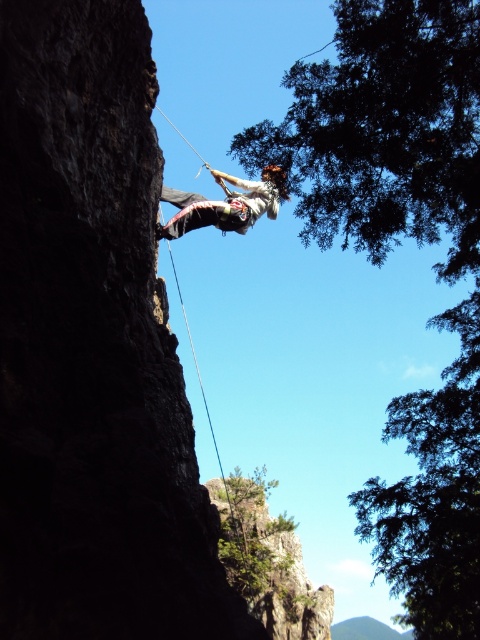
Does green leafy tree at upper right have a smaller size compared to white climbing harness at center?

Actually, green leafy tree at upper right might be larger than white climbing harness at center.

Can you confirm if green leafy tree at upper right is bigger than white climbing harness at center?

Indeed, green leafy tree at upper right has a larger size compared to white climbing harness at center.

Which is in front, point (384, 54) or point (167, 236)?

Point (384, 54) is more forward.

What are the coordinates of `green leafy tree at upper right` in the screenshot? It's located at (385, 256).